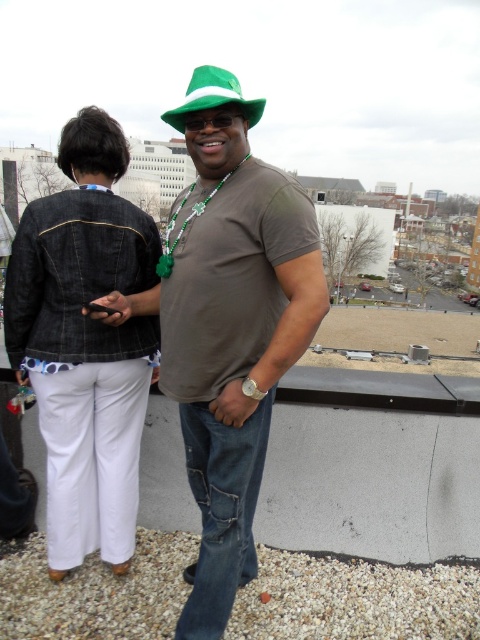
Which is behind, point (69, 364) or point (257, 106)?

The point (69, 364) is behind.

Can you confirm if denim jacket at lower left is wider than green felt fedora at center?

No.

Where is `denim jacket at lower left`? denim jacket at lower left is located at coordinates (84, 342).

Locate an element on the screen. denim jacket at lower left is located at coordinates (84, 342).

Is point (216, 570) less distant than point (50, 496)?

Yes, point (216, 570) is in front of point (50, 496).

Who is more forward, (186,433) or (59,250)?

Point (59,250) is in front.

Who is more distant from viewer, (208, 417) or (144, 282)?

The point (144, 282) is behind.

Identify the location of green matte hat at center. This screenshot has height=640, width=480. (230, 326).

Locate an element on the screen. green matte hat at center is located at coordinates (230, 326).

Identify the location of green matte hat at center. (230, 326).